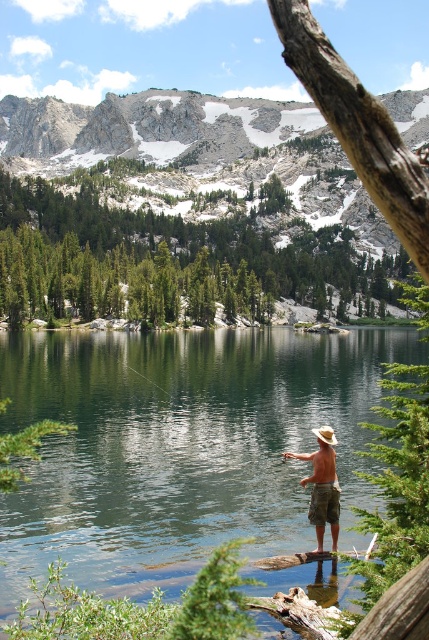
Question: Among these objects, which one is nearest to the camera?

Choices:
 (A) tan canvas hat at center
 (B) green textured pine trees at upper center
 (C) clear water at center

Answer: (C)

Question: Can you confirm if clear water at center is positioned below green textured pine trees at upper center?

Choices:
 (A) no
 (B) yes

Answer: (B)

Question: Is clear water at center positioned at the back of tan canvas hat at center?

Choices:
 (A) no
 (B) yes

Answer: (A)

Question: Which point is farther to the camera?

Choices:
 (A) (314, 515)
 (B) (244, 250)
 (C) (293, 346)

Answer: (B)

Question: Can you confirm if green textured pine trees at upper center is positioned to the right of tan canvas hat at center?

Choices:
 (A) yes
 (B) no

Answer: (B)

Question: Estimate the real-world distances between objects in this image. Which object is farther from the clear water at center?

Choices:
 (A) green textured pine trees at upper center
 (B) tan canvas hat at center

Answer: (A)